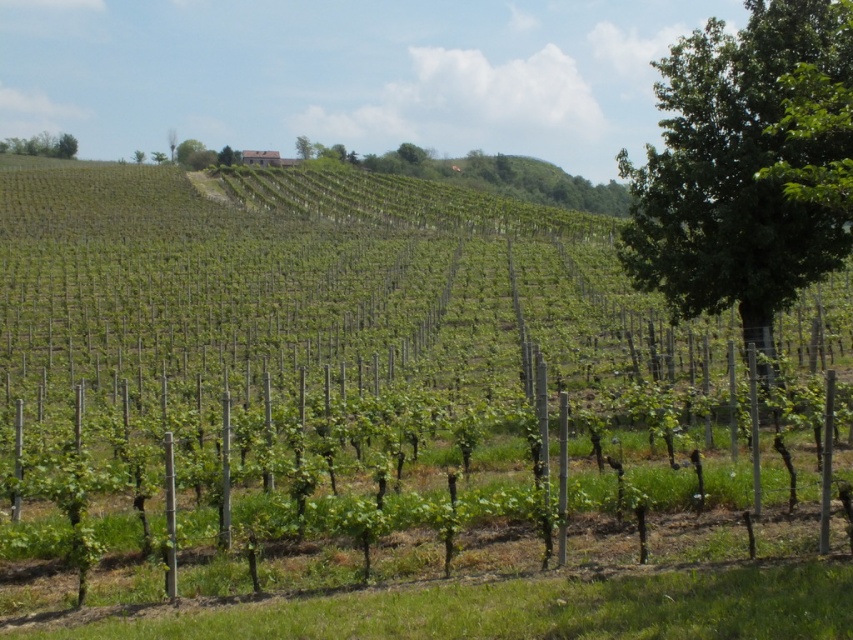
From the picture: You are standing in the vineyard and want to take a photo of the green leafy vines at center and the green leafy tree at upper left. Which object should you focus on first to ensure both are in clear view?

You should focus on the green leafy vines at center first because it is closer to you than the green leafy tree at upper left, so adjusting focus from near to far will help both be in clear view.

You are a landscape architect designing a new vineyard layout. You have two green leafy trees to place in the design. The green leafy tree at right and the green leafy tree at upper center. Which tree should you choose if you want a larger tree for shade in the vineyard?

The green leafy tree at right is bigger than the green leafy tree at upper center, so you should choose the green leafy tree at right for shade in the vineyard.

You are a gardener planning to water the green leafy vines at center and the green leafy tree at upper left. Which object is located below the other?

The green leafy vines at center are positioned under the green leafy tree at upper left, so the vines are below the tree.